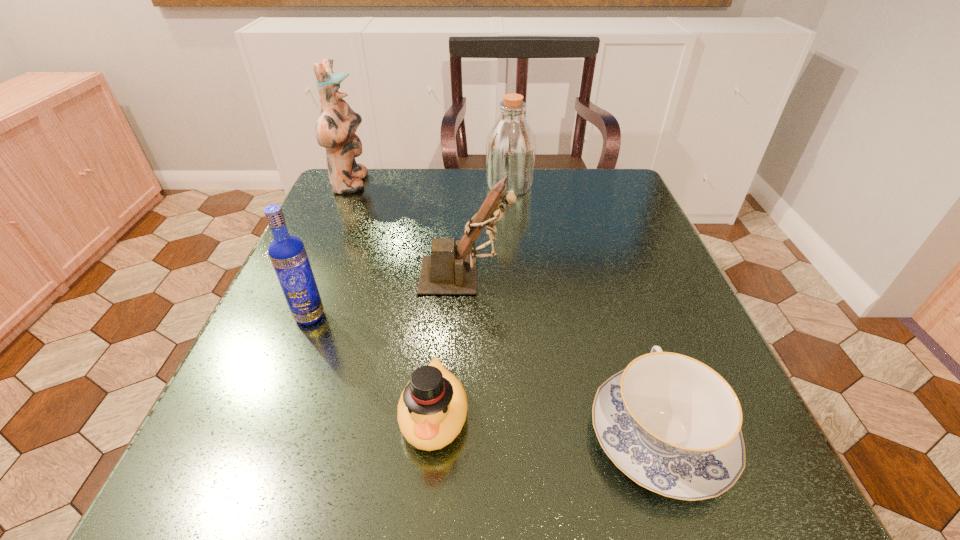
The height and width of the screenshot is (540, 960). In order to click on vacant region at the far right corner of the desktop in this screenshot , I will do `click(592, 203)`.

Identify the location of vacant region between the chinaware and the shorter figurine. (563, 355).

Where is `unoccupied position between the rightmost object and the nearer figurine`? unoccupied position between the rightmost object and the nearer figurine is located at coordinates (563, 355).

The height and width of the screenshot is (540, 960). I want to click on free spot between the fifth tallest object and the bottle, so click(471, 301).

You are a GUI agent. You are given a task and a screenshot of the screen. Output one action in this format:
    pyautogui.click(x=<x>, y=<y>)
    Task: Click on the blank region between the fourth farthest object and the duck
    This screenshot has height=540, width=960.
    Given the screenshot: What is the action you would take?
    pyautogui.click(x=372, y=366)

This screenshot has width=960, height=540. I want to click on free space between the third nearest object and the right figurine, so click(388, 296).

The image size is (960, 540). What are the coordinates of `blank region between the shortest object and the third nearest object` in the screenshot? It's located at (485, 375).

What are the coordinates of `empty location between the shortest object and the shorter figurine` in the screenshot? It's located at click(x=563, y=355).

Identify the location of unoccupied position between the right figurine and the vodka. This screenshot has height=540, width=960. (388, 296).

Identify the location of free spot between the third nearest object and the tallest object. The height and width of the screenshot is (540, 960). (330, 250).